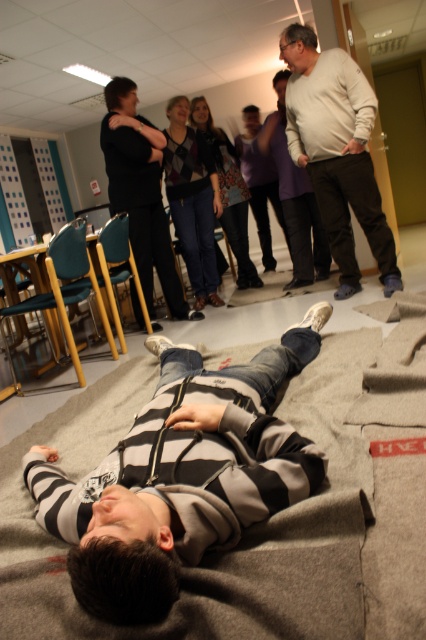
You are standing in the room and see the point at coordinates (x=265, y=520). What object is located at that point?

The point at coordinates (x=265, y=520) is on the gray woolen blanket at lower center.

You are a photographer setting up a shoot in the room. You need to place a small stool between the gray woolen blanket at lower center and the light beige pants at center. Based on their positions, where should you place the stool?

The gray woolen blanket at lower center is located below the light beige pants at center, so the stool should be placed between them, below the light beige pants at center and above the gray woolen blanket at lower center.

You are organizing a small picnic in the room and want to place both the gray woolen blanket at lower center and the light beige pants at center on the floor. Since space is limited, which item can you place first without worrying about space constraints?

The gray woolen blanket at lower center has a larger size compared to light beige pants at center, so you should place the gray woolen blanket at lower center first to ensure it fits properly before placing the smaller light beige pants at center.